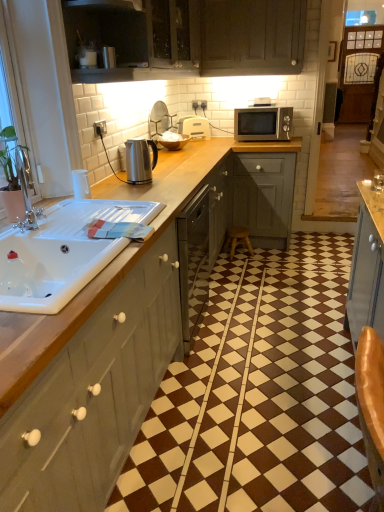
What are the coordinates of `vacant space in front of wooden stool at center` in the screenshot? It's located at (250, 262).